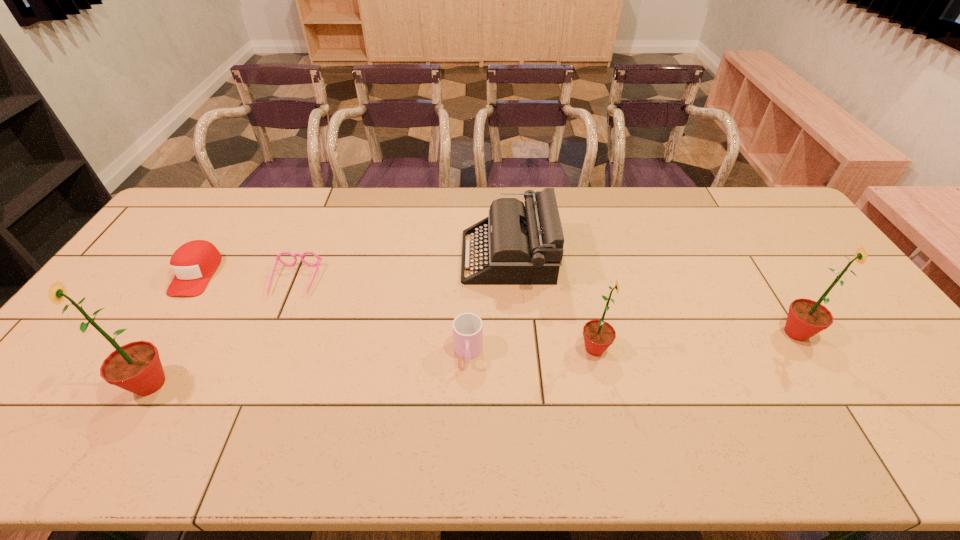
Where is `vacant space located 0.080m with the handle on the side of the cup`? vacant space located 0.080m with the handle on the side of the cup is located at coordinates (468, 400).

This screenshot has height=540, width=960. Find the location of `object at the far edge`. object at the far edge is located at coordinates (524, 244).

Where is `object present at the near edge`? The image size is (960, 540). object present at the near edge is located at coordinates (136, 367).

This screenshot has height=540, width=960. What are the coordinates of `object positioned at the left edge` in the screenshot? It's located at (193, 263).

The width and height of the screenshot is (960, 540). Find the location of `vacant space at the far edge of the desktop`. vacant space at the far edge of the desktop is located at coordinates (686, 202).

The height and width of the screenshot is (540, 960). Identify the location of free space at the near edge of the desktop. (321, 387).

In order to click on blank space at the left edge of the desktop in this screenshot , I will do `click(164, 248)`.

You are a GUI agent. You are given a task and a screenshot of the screen. Output one action in this format:
    pyautogui.click(x=<x>, y=<y>)
    Task: Click on the free space at the right edge of the desktop
    
    Given the screenshot: What is the action you would take?
    pyautogui.click(x=884, y=377)

Locate an element on the screen. free spot between the fifth object from right to left and the second tallest object is located at coordinates (545, 307).

At what (x,y) coordinates should I click in order to perform the action: click on vacant space that's between the shortest object and the sixth object from left to right. Please return your answer as a coordinate pair (x, y). This screenshot has width=960, height=540. Looking at the image, I should click on (445, 315).